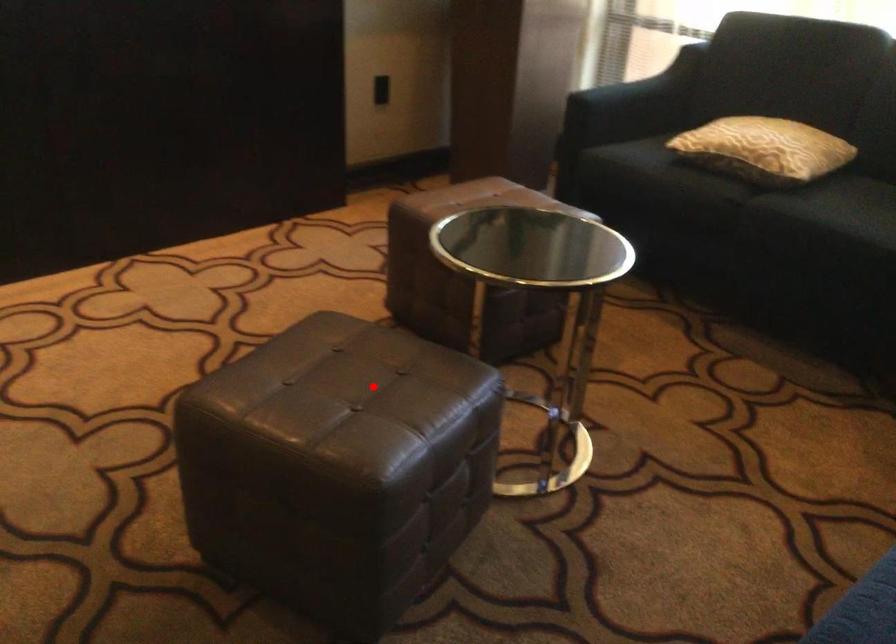
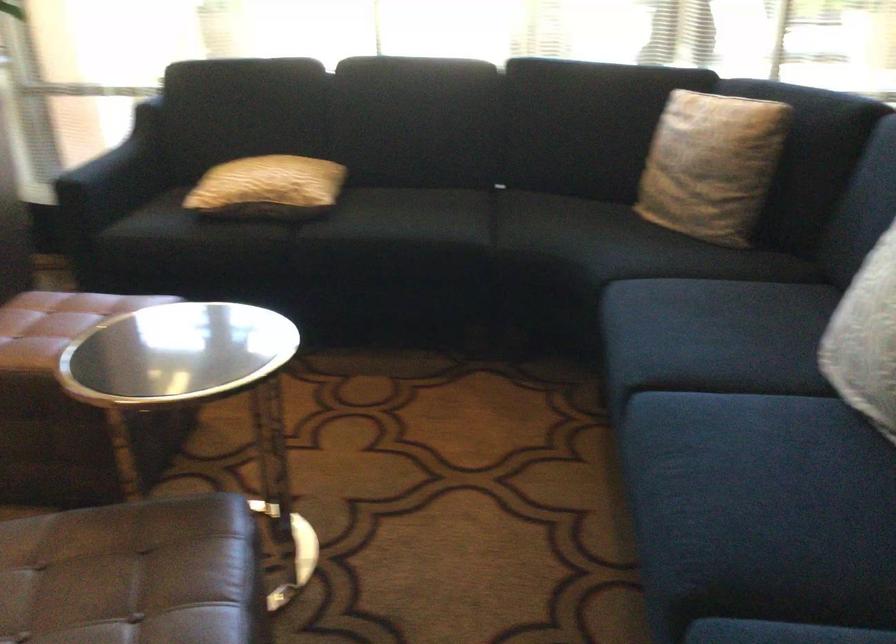
Locate, in the second image, the point that corresponds to the highlighted location in the first image.

(134, 574)